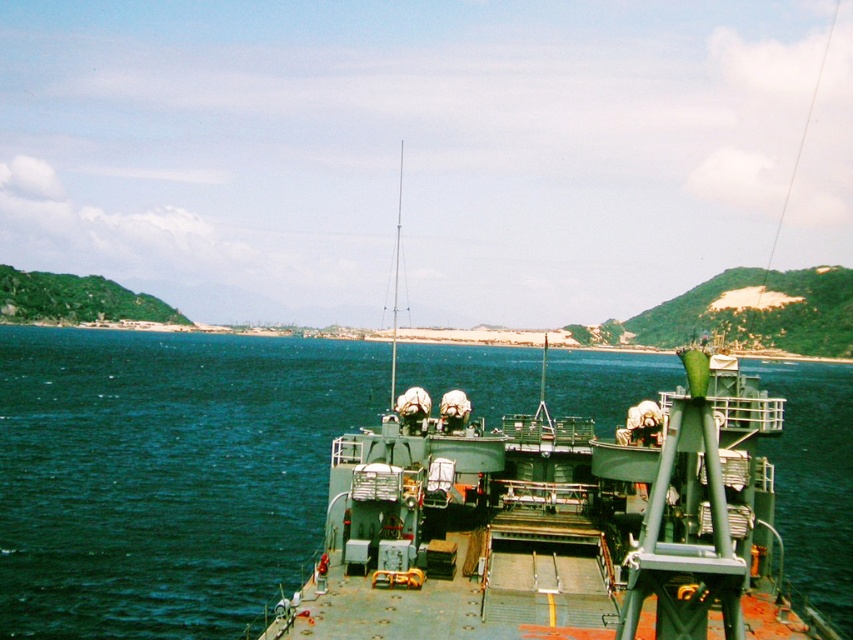
Consider the image. You are a sailor on the naval ship and need to determine the visibility of the green matte boat at center relative to the blue water at center. Which object appears taller from your vantage point?

The green matte boat at center appears taller than the blue water at center because the blue water at center is shorter than the green matte boat at center.